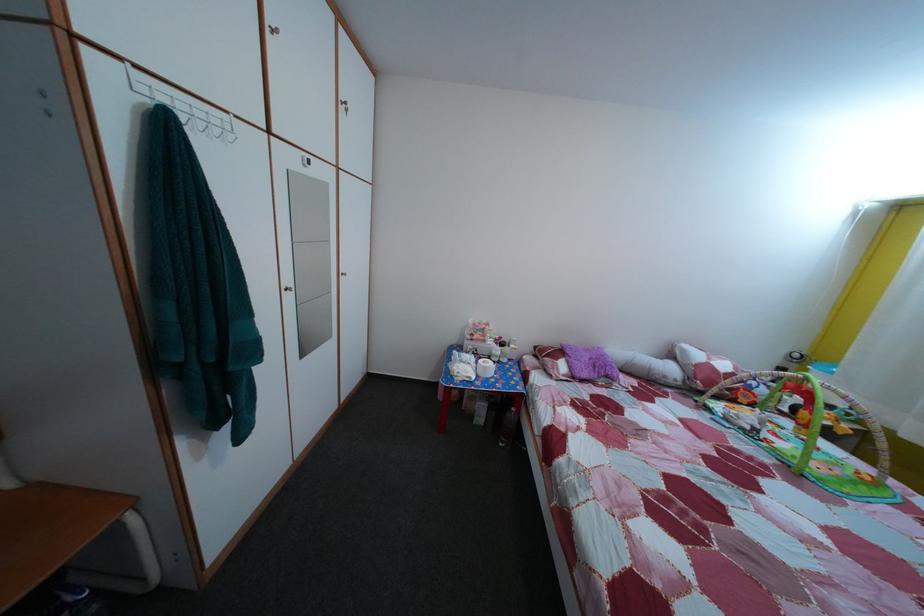
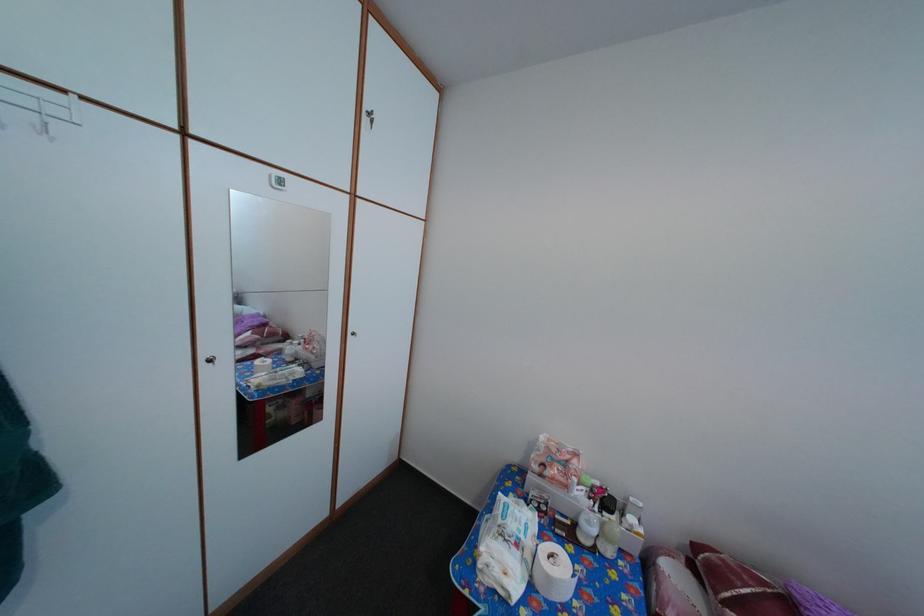
Where in the second image is the point corresponding to [494,376] from the first image?

(558, 586)